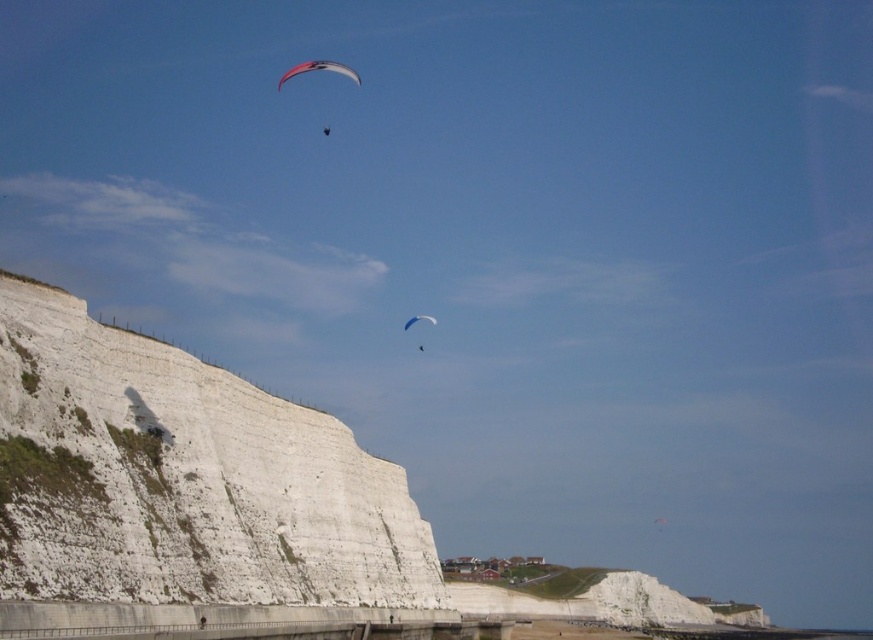
Does matte pink parachute at upper center have a smaller size compared to white matte parachute at upper center?

Incorrect, matte pink parachute at upper center is not smaller in size than white matte parachute at upper center.

Is matte pink parachute at upper center bigger than white matte parachute at upper center?

Correct, matte pink parachute at upper center is larger in size than white matte parachute at upper center.

Where is `matte pink parachute at upper center`? matte pink parachute at upper center is located at coordinates (320, 68).

Between white smooth cliff at left and white matte parachute at upper center, which one has less height?

white matte parachute at upper center is shorter.

Does white smooth cliff at left lie behind white matte parachute at upper center?

No, white smooth cliff at left is closer to the viewer.

Between point (193, 502) and point (414, 323), which one is positioned in front?

Positioned in front is point (193, 502).

Identify the location of white smooth cliff at left. (184, 480).

Looking at this image, is white smooth cliff at left positioned in front of matte pink parachute at upper center?

Yes, it is.

Is point (280, 592) positioned in front of point (308, 64)?

That is True.

Locate an element on the screen. white smooth cliff at left is located at coordinates (184, 480).